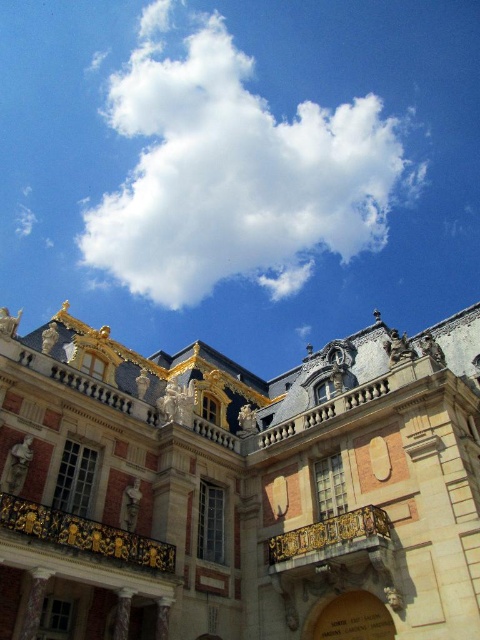
Question: In this image, where is golden ornate balcony at upper center located relative to gold ornate railing at center?

Choices:
 (A) left
 (B) right

Answer: (B)

Question: Which point is farther to the camera?

Choices:
 (A) white fluffy cloud at upper center
 (B) gold ornate balcony at center
 (C) golden ornate balcony at upper center

Answer: (A)

Question: Which object appears closest to the camera in this image?

Choices:
 (A) gold ornate railing at center
 (B) golden ornate balcony at upper center
 (C) gold ornate balcony at center
 (D) white fluffy cloud at upper center

Answer: (B)

Question: Which point is closer to the camera?

Choices:
 (A) (276, 273)
 (B) (477, 612)
 (C) (98, 552)

Answer: (B)

Question: Is gold ornate railing at center to the right of gold ornate balcony at center from the viewer's perspective?

Choices:
 (A) yes
 (B) no

Answer: (B)

Question: Does golden ornate balcony at upper center have a lesser width compared to gold ornate railing at center?

Choices:
 (A) yes
 (B) no

Answer: (B)